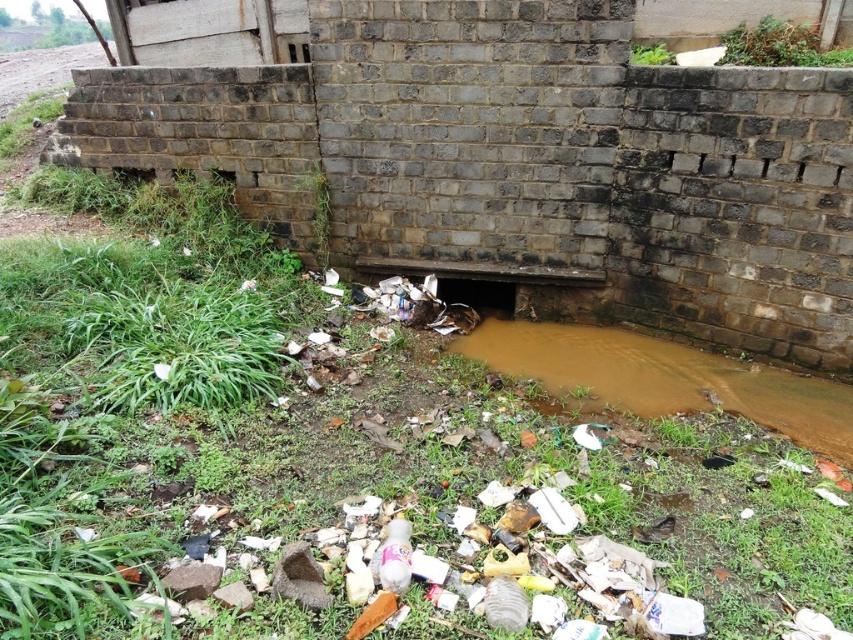
Does point (699, 376) come farther from viewer compared to point (494, 294)?

No, it is in front of (494, 294).

Based on the photo, does brown muddy stream at center have a lesser height compared to black rubber hole at center?

In fact, brown muddy stream at center may be taller than black rubber hole at center.

Who is more distant from viewer, (776, 410) or (482, 284)?

Positioned behind is point (482, 284).

Locate an element on the screen. The image size is (853, 640). brown muddy stream at center is located at coordinates (664, 378).